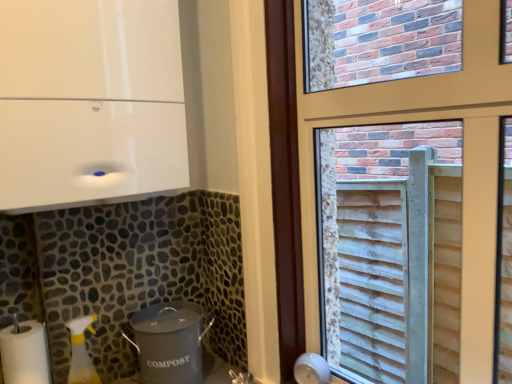
Question: Choose the correct answer: Is white glossy cabinet at upper left, which appears as the 2th appliance when ordered from the bottom, inside white matte paper towel at lower left or outside it?

Choices:
 (A) inside
 (B) outside

Answer: (B)

Question: In terms of height, does white glossy cabinet at upper left, which is counted as the first appliance, starting from the top, look taller or shorter compared to white matte paper towel at lower left?

Choices:
 (A) tall
 (B) short

Answer: (A)

Question: Based on their relative distances, which object is nearer to the white matte paper towel at lower left?

Choices:
 (A) wooden slats at right
 (B) white glossy cabinet at upper left, which appears as the 2th appliance when ordered from the bottom
 (C) gray matte compost bin at lower center, which is counted as the 1th appliance, starting from the bottom

Answer: (C)

Question: Estimate the real-world distances between objects in this image. Which object is farther from the wooden slats at right?

Choices:
 (A) gray matte compost bin at lower center, the 2th appliance viewed from the top
 (B) white matte paper towel at lower left
 (C) white glossy cabinet at upper left, which is counted as the first appliance, starting from the top

Answer: (B)